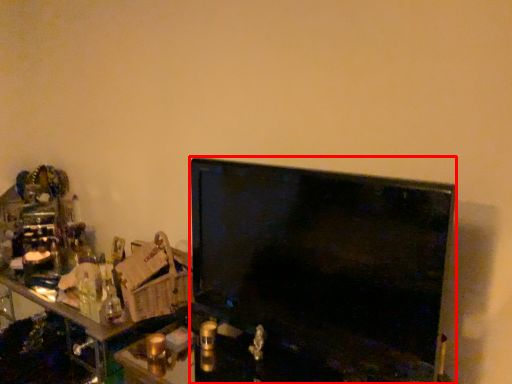
Question: From the image's perspective, where is television (annotated by the red box) located relative to computer?

Choices:
 (A) above
 (B) below

Answer: (A)